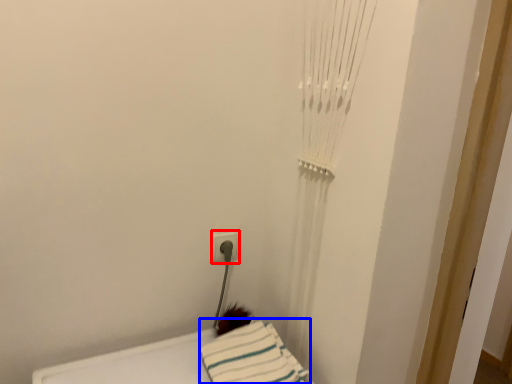
Question: Which point is further to the camera, electric outlet (highlighted by a red box) or sheet (highlighted by a blue box)?

Choices:
 (A) electric outlet
 (B) sheet

Answer: (A)